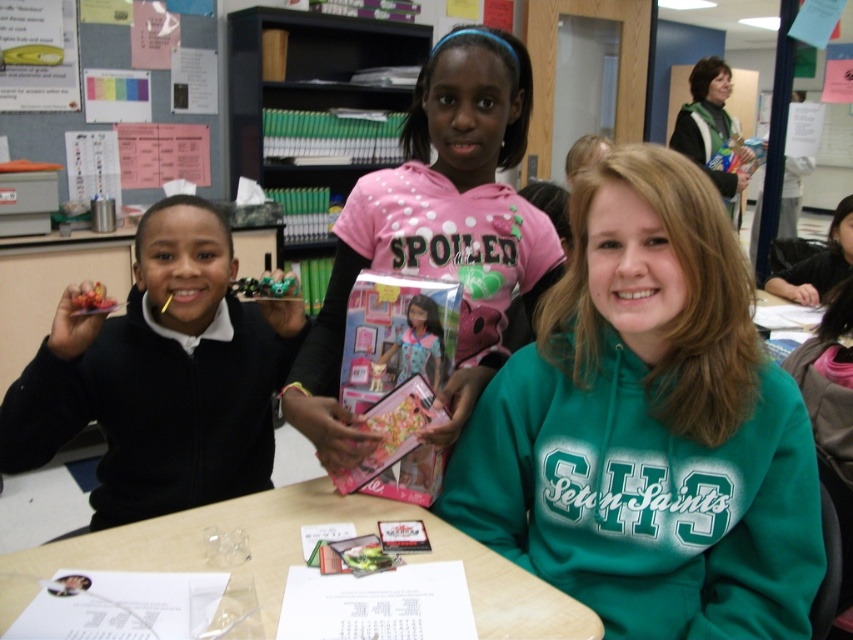
Question: Which object appears farthest from the camera in this image?

Choices:
 (A) pink matte doll at center
 (B) green fleece sweatshirt at center
 (C) matte black toy car at left
 (D) matte pink paper at upper left

Answer: (D)

Question: Does pink matte doll at center lie behind wooden table at center?

Choices:
 (A) no
 (B) yes

Answer: (B)

Question: Estimate the real-world distances between objects in this image. Which object is farther from the matte pink paper at upper left?

Choices:
 (A) wooden table at center
 (B) pink matte doll at center
 (C) matte black toy car at left
 (D) green fleece sweatshirt at center

Answer: (D)

Question: Does green fleece sweatshirt at center appear over matte black toy car at left?

Choices:
 (A) no
 (B) yes

Answer: (B)

Question: Which point appears farthest from the camera in this image?

Choices:
 (A) (312, 518)
 (B) (109, 26)
 (C) (581, 257)

Answer: (B)

Question: Is matte black toy car at left below metallic green toy car at center?

Choices:
 (A) yes
 (B) no

Answer: (A)